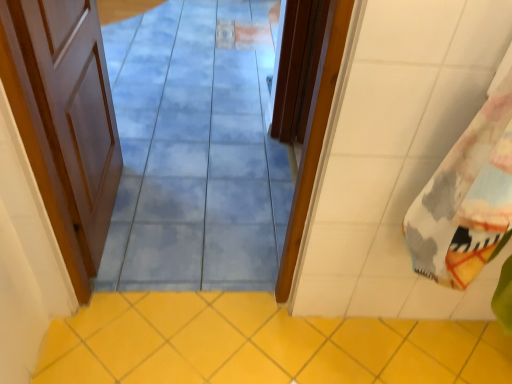
Question: Would you say wooden door at center, positioned as the second door in left-to-right order, is part of white wood door at left, which is the second door in right-to-left order,'s contents?

Choices:
 (A) yes
 (B) no

Answer: (B)

Question: Considering the relative sizes of white wood door at left, the 1th door viewed from the left, and wooden door at center, positioned as the second door in left-to-right order, in the image provided, is white wood door at left, the 1th door viewed from the left, bigger than wooden door at center, positioned as the second door in left-to-right order,?

Choices:
 (A) yes
 (B) no

Answer: (B)

Question: Considering the relative sizes of white wood door at left, which is the second door in right-to-left order, and wooden door at center, positioned as the second door in left-to-right order, in the image provided, is white wood door at left, which is the second door in right-to-left order, smaller than wooden door at center, positioned as the second door in left-to-right order,?

Choices:
 (A) yes
 (B) no

Answer: (A)

Question: Is white wood door at left, which is the second door in right-to-left order, taller than wooden door at center, positioned as the second door in left-to-right order?

Choices:
 (A) yes
 (B) no

Answer: (A)

Question: Can you see white wood door at left, the 1th door viewed from the left, touching wooden door at center, the first door viewed from the right?

Choices:
 (A) yes
 (B) no

Answer: (B)

Question: From a real-world perspective, is white wood door at left, the 1th door viewed from the left, physically below wooden door at center, positioned as the second door in left-to-right order?

Choices:
 (A) yes
 (B) no

Answer: (B)

Question: Can you confirm if wooden door at center, the first door viewed from the right, is positioned to the left of blue glossy tile at center?

Choices:
 (A) yes
 (B) no

Answer: (B)

Question: Is wooden door at center, positioned as the second door in left-to-right order, positioned beyond the bounds of blue glossy tile at center?

Choices:
 (A) no
 (B) yes

Answer: (B)

Question: Is the depth of wooden door at center, positioned as the second door in left-to-right order, greater than that of blue glossy tile at center?

Choices:
 (A) yes
 (B) no

Answer: (A)

Question: Are wooden door at center, the first door viewed from the right, and blue glossy tile at center far apart?

Choices:
 (A) yes
 (B) no

Answer: (A)

Question: Are wooden door at center, the first door viewed from the right, and blue glossy tile at center beside each other?

Choices:
 (A) yes
 (B) no

Answer: (B)

Question: Is wooden door at center, positioned as the second door in left-to-right order, at the right side of blue glossy tile at center?

Choices:
 (A) no
 (B) yes

Answer: (B)

Question: Is there a large distance between white wood door at left, the 1th door viewed from the left, and blue glossy tile at center?

Choices:
 (A) yes
 (B) no

Answer: (B)